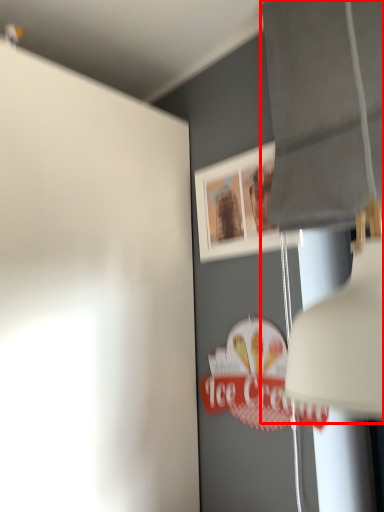
Question: From the image's perspective, where is lamp (annotated by the red box) located in relation to picture frame in the image?

Choices:
 (A) below
 (B) above

Answer: (B)